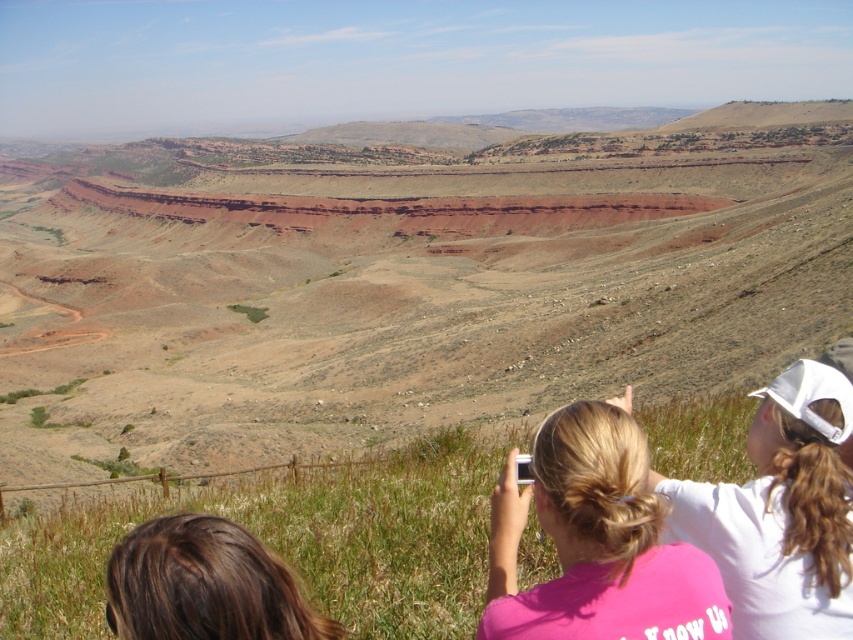
How distant is pink fabric shirt at lower right from brown hair at lower left?

pink fabric shirt at lower right and brown hair at lower left are 12.71 meters apart.

Is pink fabric shirt at lower right to the right of brown hair at lower left from the viewer's perspective?

Correct, you'll find pink fabric shirt at lower right to the right of brown hair at lower left.

At what (x,y) coordinates should I click in order to perform the action: click on pink fabric shirt at lower right. Please return your answer as a coordinate pair (x, y). This screenshot has width=853, height=640. Looking at the image, I should click on (781, 513).

The image size is (853, 640). Identify the location of pink fabric shirt at lower right. (781, 513).

Is pink fabric at center to the left of pink fabric shirt at lower right from the viewer's perspective?

Correct, you'll find pink fabric at center to the left of pink fabric shirt at lower right.

Who is higher up, pink fabric at center or pink fabric shirt at lower right?

pink fabric shirt at lower right

Measure the distance between point (602, 403) and camera.

Point (602, 403) and camera are 84.69 feet apart from each other.

You are a GUI agent. You are given a task and a screenshot of the screen. Output one action in this format:
    pyautogui.click(x=<x>, y=<y>)
    Task: Click on the pink fabric at center
    
    Given the screenshot: What is the action you would take?
    pyautogui.click(x=596, y=541)

Who is positioned more to the right, pink fabric at center or brown hair at lower left?

pink fabric at center

Can you confirm if pink fabric at center is thinner than brown hair at lower left?

In fact, pink fabric at center might be wider than brown hair at lower left.

Locate an element on the screen. pink fabric at center is located at coordinates (596, 541).

You are a GUI agent. You are given a task and a screenshot of the screen. Output one action in this format:
    pyautogui.click(x=<x>, y=<y>)
    Task: Click on the pink fabric at center
    The width and height of the screenshot is (853, 640).
    Given the screenshot: What is the action you would take?
    pyautogui.click(x=596, y=541)